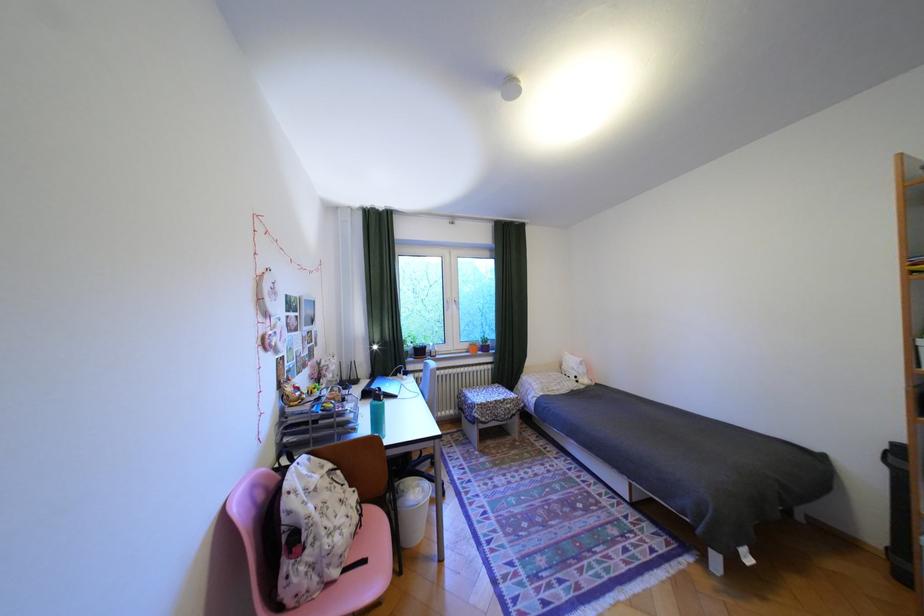
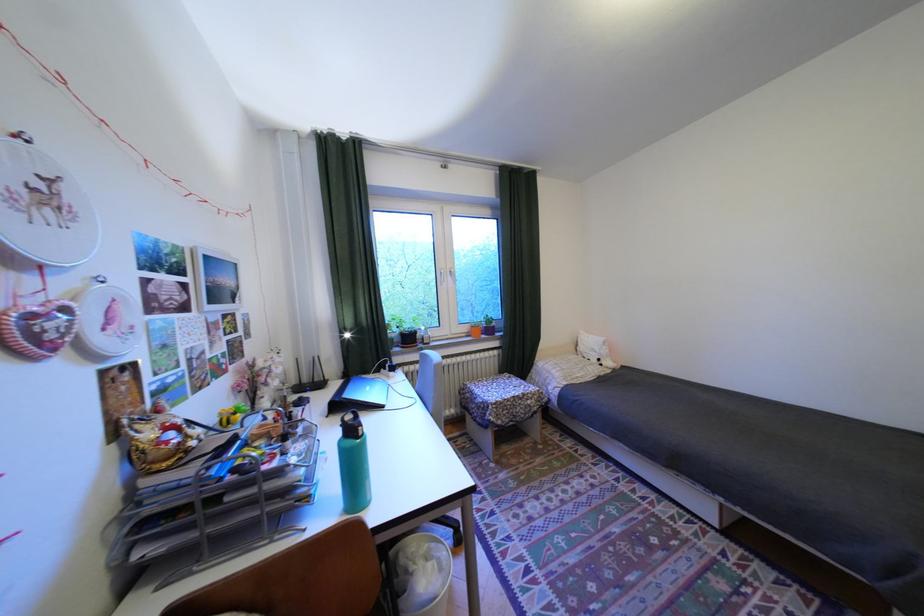
In the second image, find the point that corresponds to the point at 588,378 in the first image.

(611, 360)